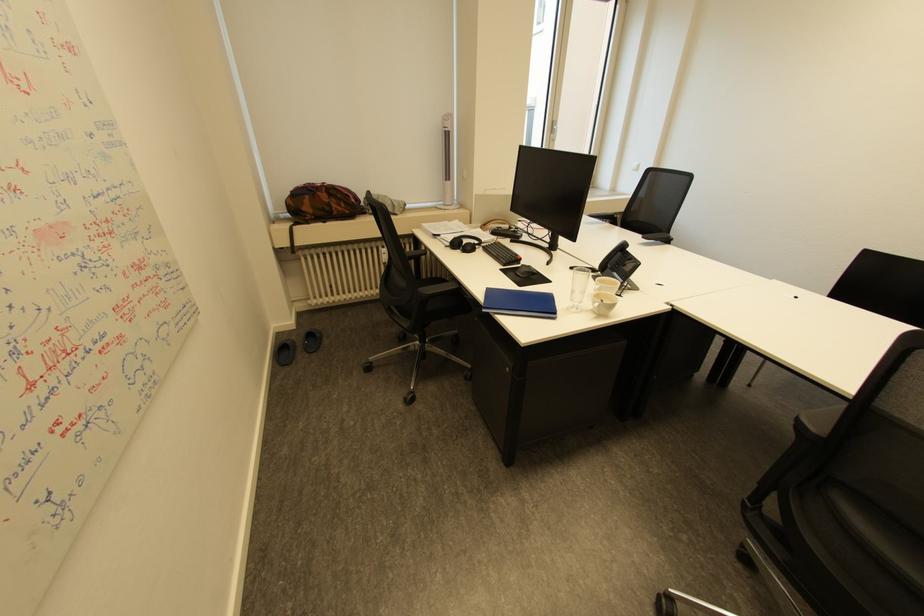
What are the coordinates of `glass drinking cup` in the screenshot? It's located at (578, 286).